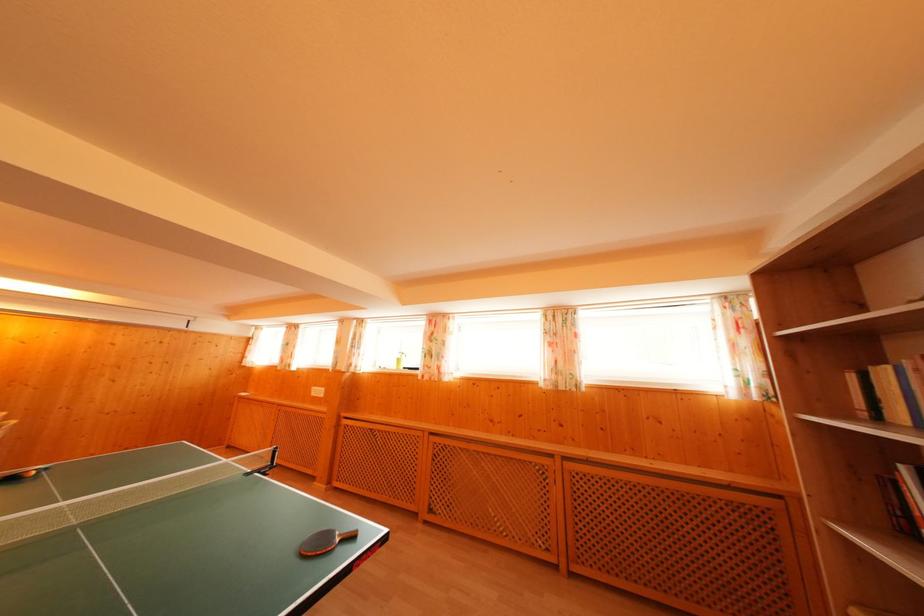
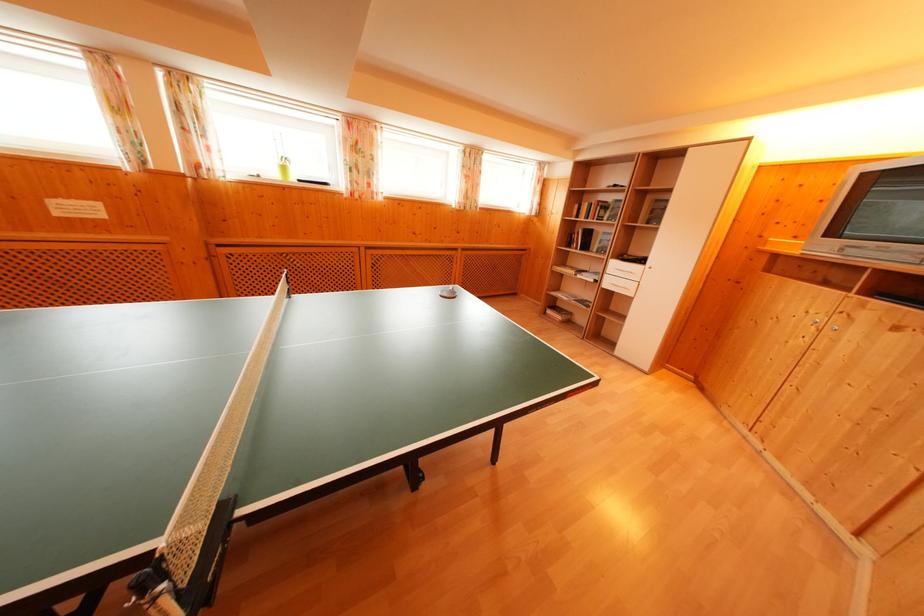
The point at (857, 383) is marked in the first image. Where is the corresponding point in the second image?

(581, 211)